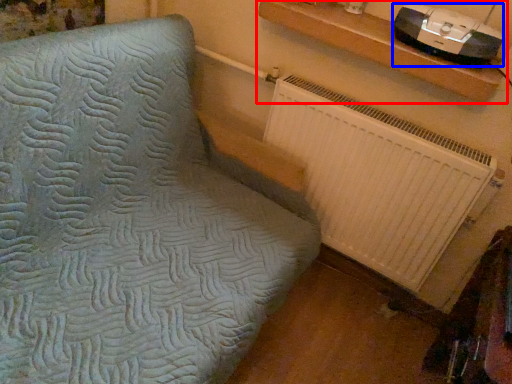
Question: Among these objects, which one is nearest to the camera, shelf (highlighted by a red box) or stereo (highlighted by a blue box)?

Choices:
 (A) shelf
 (B) stereo

Answer: (B)